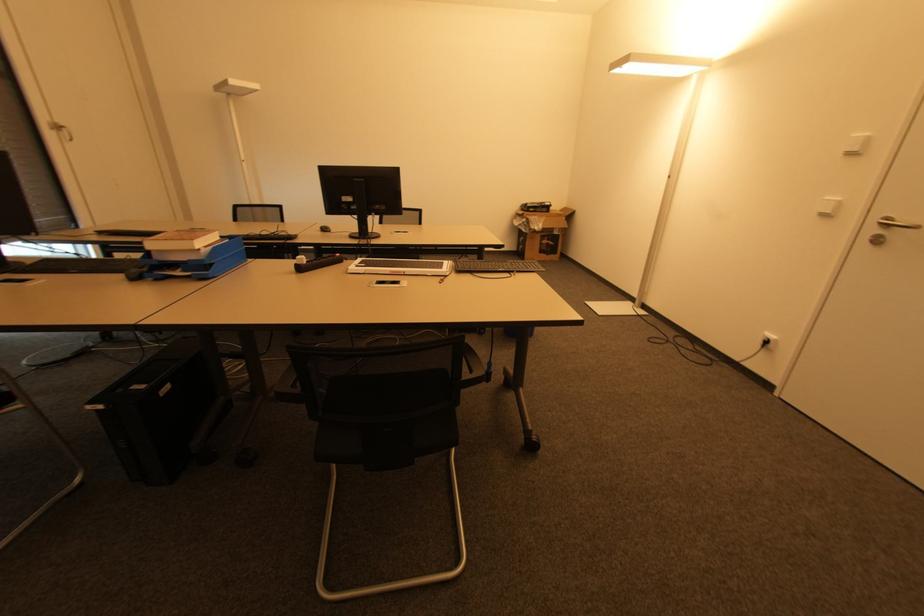
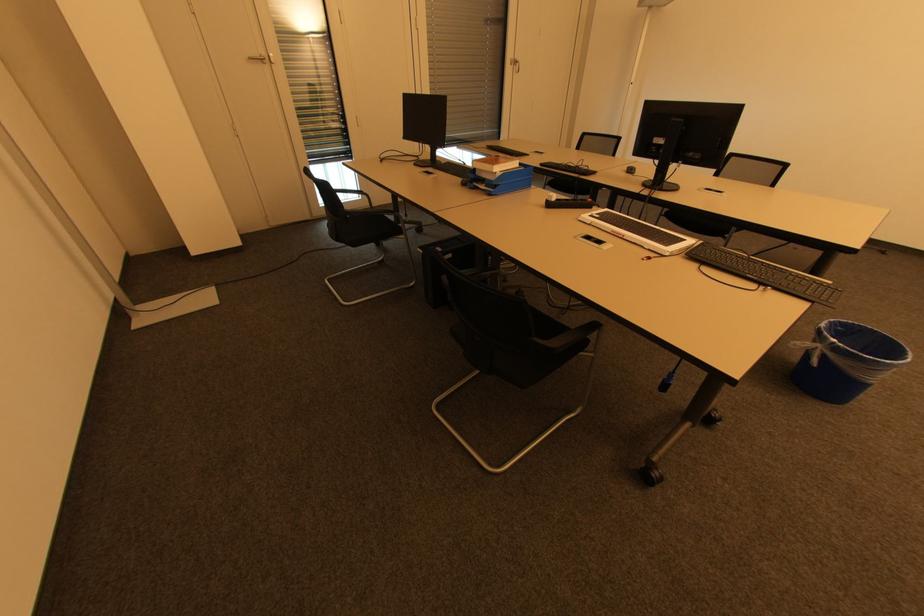
Find the pixel in the second image that matches [331,232] in the first image.

(634, 174)